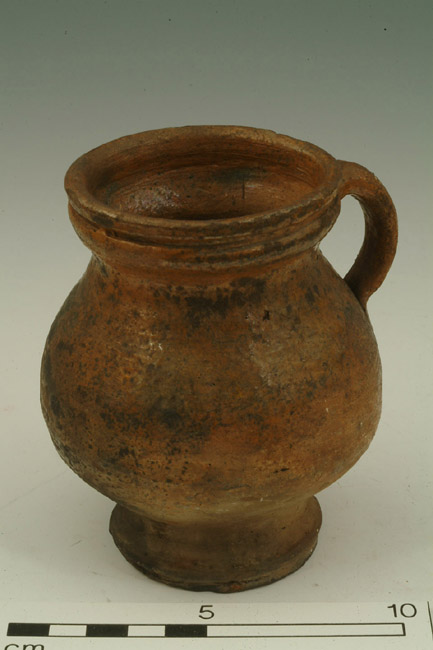
This screenshot has width=433, height=650. Identify the location of rustic urn. (213, 422).